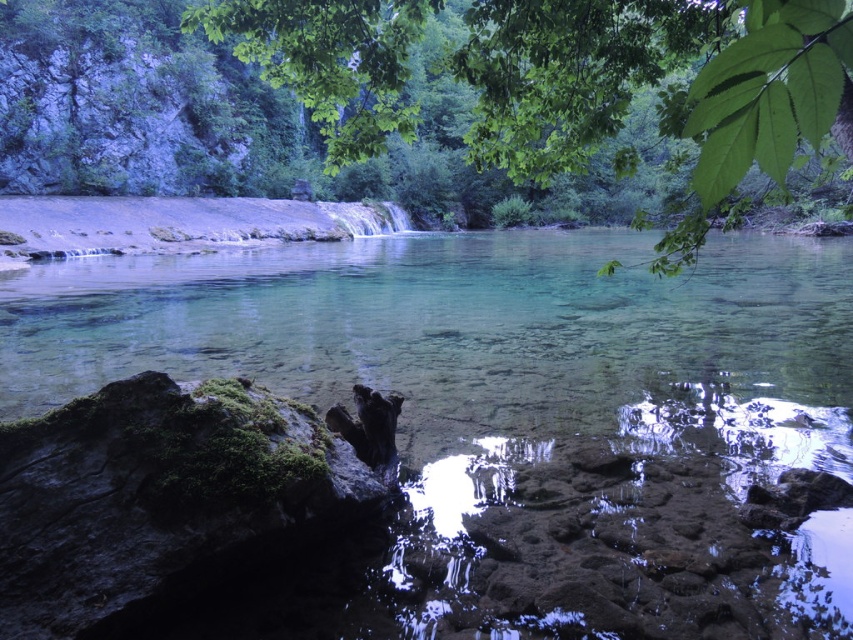
Is point (364, 348) positioned after point (573, 35)?

Yes, it is behind point (573, 35).

Can you confirm if clear glassy water at center is bigger than green leafy tree at upper center?

Incorrect, clear glassy water at center is not larger than green leafy tree at upper center.

What do you see at coordinates (463, 372) in the screenshot?
I see `clear glassy water at center` at bounding box center [463, 372].

I want to click on clear glassy water at center, so click(463, 372).